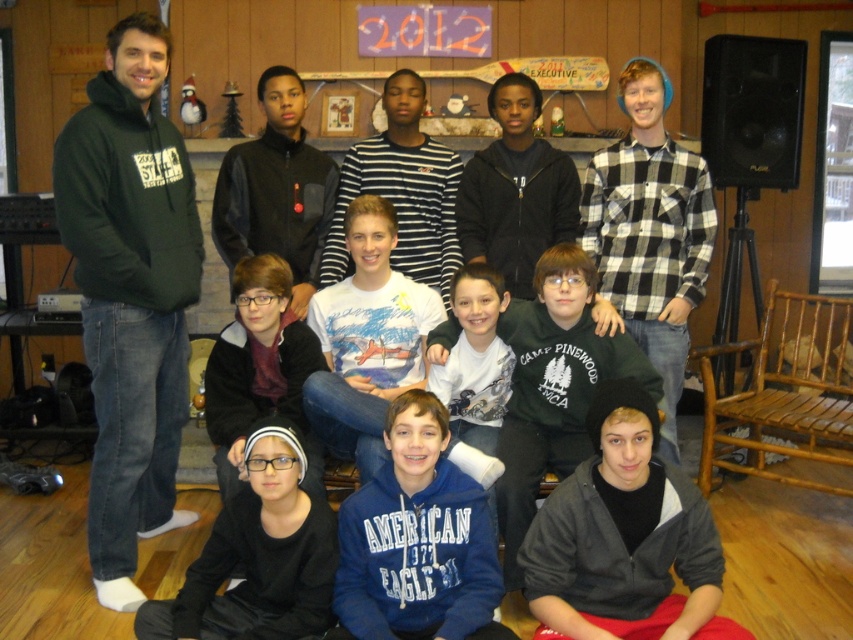
Question: Is black checkered flannel shirt at right to the right of white striped shirt at center from the viewer's perspective?

Choices:
 (A) yes
 (B) no

Answer: (A)

Question: Observing the image, what is the correct spatial positioning of green fleece sweatshirt at center in reference to white striped shirt at center?

Choices:
 (A) above
 (B) below

Answer: (B)

Question: Based on their relative distances, which object is nearer to the black matte hoodie at lower left?

Choices:
 (A) white striped shirt at center
 (B) green fleece sweatshirt at center
 (C) blue fleece sweatshirt at lower center
 (D) gray fleece jacket at lower right

Answer: (C)

Question: In this image, where is black matte hoodie at lower left located relative to black leather jacket at center?

Choices:
 (A) left
 (B) right

Answer: (B)

Question: Which of the following is the closest to the observer?

Choices:
 (A) (556, 394)
 (B) (386, 632)

Answer: (B)

Question: Which of these objects is positioned farthest from the white striped shirt at center?

Choices:
 (A) black leather jacket at center
 (B) black zip-up hoodie at center

Answer: (A)